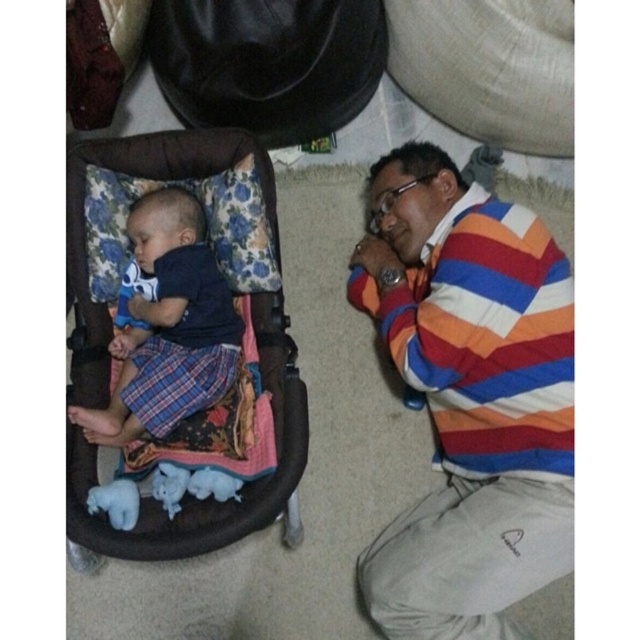
Question: Can you confirm if brown fabric baby carriage at center is positioned below matte blue shirt at left?

Choices:
 (A) yes
 (B) no

Answer: (A)

Question: Which object appears farthest from the camera in this image?

Choices:
 (A) matte blue shirt at left
 (B) brown fabric baby carriage at center
 (C) striped cotton shirt at lower right

Answer: (A)

Question: Among these objects, which one is farthest from the camera?

Choices:
 (A) matte blue shirt at left
 (B) striped cotton shirt at lower right
 (C) brown fabric baby carriage at center

Answer: (A)

Question: Is brown fabric baby carriage at center above matte blue shirt at left?

Choices:
 (A) yes
 (B) no

Answer: (B)

Question: Is striped cotton shirt at lower right positioned before brown fabric baby carriage at center?

Choices:
 (A) no
 (B) yes

Answer: (A)

Question: Which point is farther from the camera taking this photo?

Choices:
 (A) (189, 323)
 (B) (276, 474)

Answer: (A)